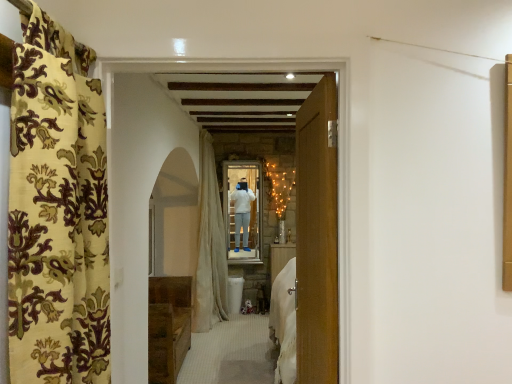
Question: From a real-world perspective, relative to velvet floral curtain at left, which ranks as the 1th curtain in front-to-back order, is wooden door at center vertically above or below?

Choices:
 (A) above
 (B) below

Answer: (B)

Question: Is point (115, 238) closer or farther from the camera than point (32, 326)?

Choices:
 (A) closer
 (B) farther

Answer: (B)

Question: Which object is positioned closest to the brown wooden chest at lower left?

Choices:
 (A) velvet floral curtain at left, which ranks as the 1th curtain in front-to-back order
 (B) white sheer curtain at center, the first curtain in the back-to-front sequence
 (C) wooden door at center

Answer: (B)

Question: Which of these objects is positioned closest to the white sheer curtain at center, marked as the second curtain in a front-to-back arrangement?

Choices:
 (A) velvet floral curtain at left, the second curtain viewed from the back
 (B) wooden door at center
 (C) brown wooden chest at lower left

Answer: (C)